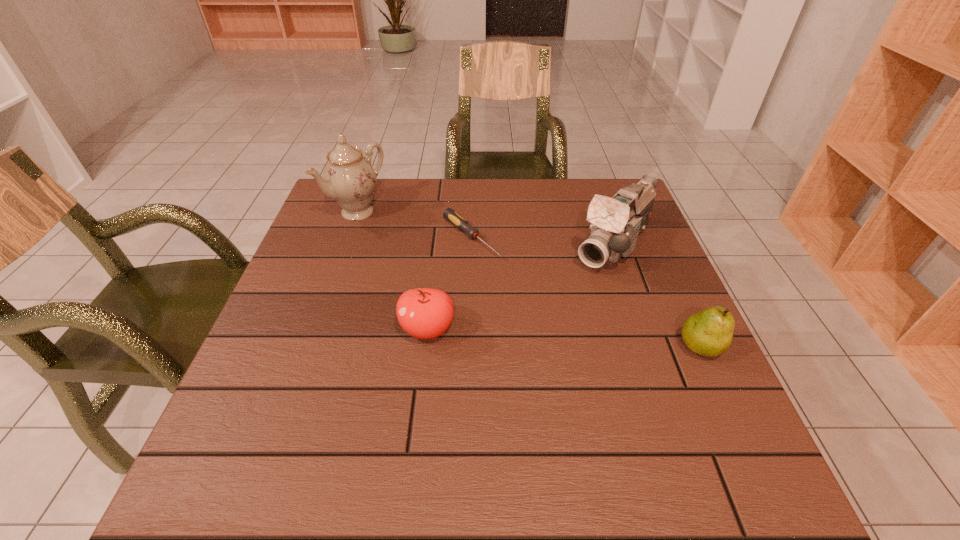
Where is `vacant space situated 0.200m insert the shortest object into a screw head`? This screenshot has width=960, height=540. vacant space situated 0.200m insert the shortest object into a screw head is located at coordinates (544, 302).

Where is `free location located on the spout of the tallest object`? The height and width of the screenshot is (540, 960). free location located on the spout of the tallest object is located at coordinates (411, 248).

I want to click on free space located 0.230m on the spout of the tallest object, so click(x=431, y=262).

At what (x,y) coordinates should I click in order to perform the action: click on blank area located on the spout of the tallest object. Please return your answer as a coordinate pair (x, y). The height and width of the screenshot is (540, 960). Looking at the image, I should click on (391, 235).

The width and height of the screenshot is (960, 540). Identify the location of free spot located 0.060m on the front-facing side of the camcorder. (582, 286).

Identify the location of vacant space located on the front-facing side of the camcorder. (567, 303).

Find the location of a particular element. The image size is (960, 540). blank area located on the front-facing side of the camcorder is located at coordinates (573, 296).

You are a GUI agent. You are given a task and a screenshot of the screen. Output one action in this format:
    pyautogui.click(x=<x>, y=<y>)
    Task: Click on the screwdriver that is at the far edge
    
    Given the screenshot: What is the action you would take?
    pyautogui.click(x=458, y=221)

At what (x,y) coordinates should I click in order to perform the action: click on chinaware located at the far edge. Please return your answer as a coordinate pair (x, y). Looking at the image, I should click on (349, 178).

The image size is (960, 540). Find the location of `camcorder at the far edge`. camcorder at the far edge is located at coordinates (617, 222).